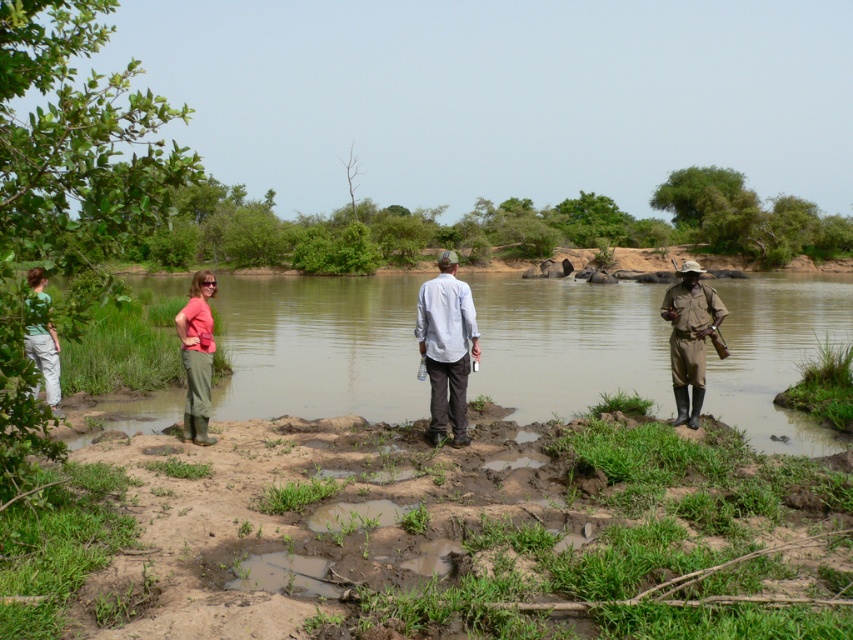
Question: Among these objects, which one is nearest to the camera?

Choices:
 (A) brown uniform at center
 (B) light blue cotton shirt at center
 (C) green grassy river at center
 (D) matte pink shirt at center

Answer: (B)

Question: Which point is farther to the camera?

Choices:
 (A) green fabric shirt at left
 (B) light blue cotton shirt at center
 (C) matte pink shirt at center
 (D) green grassy river at center

Answer: (D)

Question: Where is brown uniform at center located in relation to matte pink shirt at center in the image?

Choices:
 (A) above
 (B) below

Answer: (A)

Question: Is light blue cotton shirt at center to the right of green fabric shirt at left from the viewer's perspective?

Choices:
 (A) yes
 (B) no

Answer: (A)

Question: Does matte pink shirt at center appear on the left side of green fabric shirt at left?

Choices:
 (A) yes
 (B) no

Answer: (B)

Question: Considering the real-world distances, which object is farthest from the matte pink shirt at center?

Choices:
 (A) green fabric shirt at left
 (B) light blue cotton shirt at center

Answer: (B)